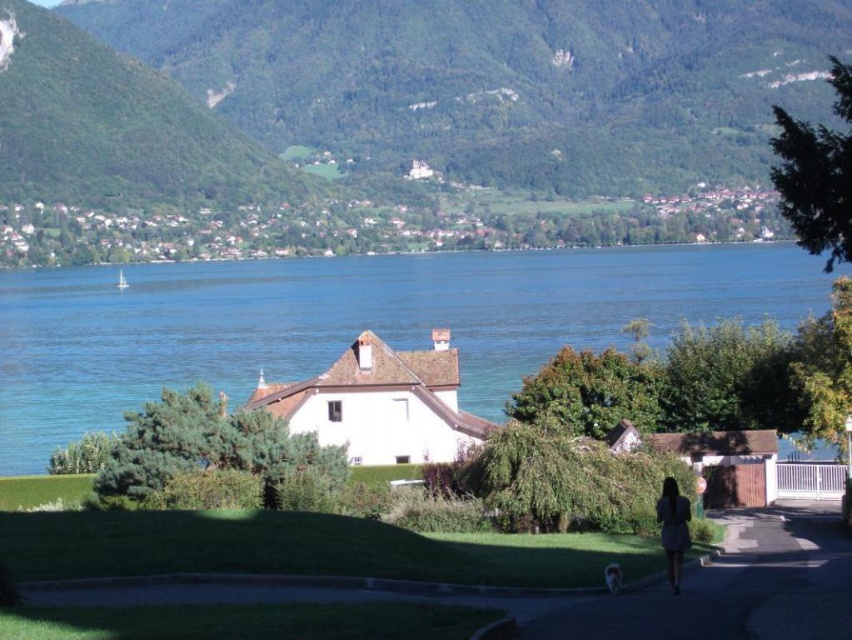
Based on the photo, you are standing at the lakeside and want to reach the point marked as point (682, 77). Given that you can walk at a speed of 3 feet per second, how many seconds will it take you to reach that point?

The point (682, 77) is 1673.84 feet away from the viewer. At a walking speed of 3 feet per second, it would take approximately 1673.84 divided by 3, which is about 557.95 seconds to reach the point.

You are standing at the point closer to the camera in the image. Which point are you at, point [292,10] or point [775,573]?

You are at point [292,10] because it is closer to the camera than point [775,573].

From the picture: You are standing at the lakeside and see the green leafy mountain at upper center and the dark green asphalt at lower center. Which object is located higher in the image?

The green leafy mountain at upper center is positioned over dark green asphalt at lower center, so it is higher in the image.